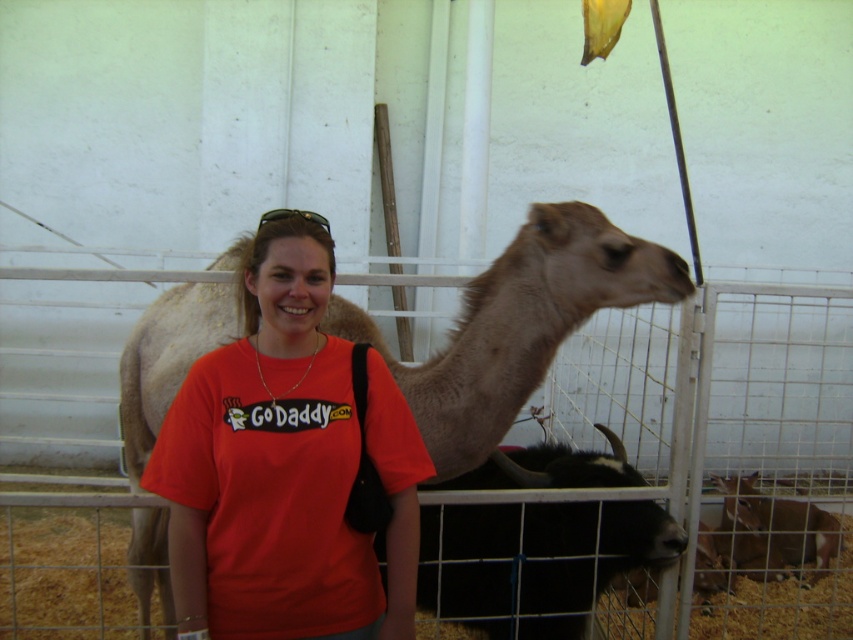
Can you confirm if light brown fur at center is positioned to the left of brown furry goat at lower right?

Yes, light brown fur at center is to the left of brown furry goat at lower right.

How much distance is there between light brown fur at center and brown furry goat at lower right?

light brown fur at center is 2.14 meters away from brown furry goat at lower right.

Where is `light brown fur at center`? light brown fur at center is located at coordinates (518, 324).